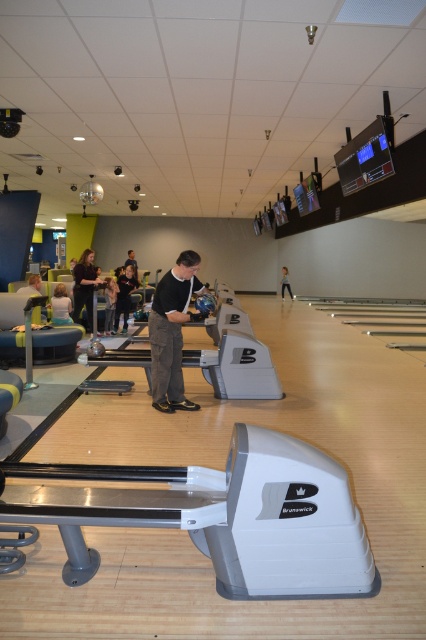
You are a photographer trying to capture a photo of the dark gray fabric pants at center and the dark gray pants at center. Which one appears taller in the image?

The dark gray fabric pants at center is taller than dark gray pants at center according to the description.

You are standing at the entrance of the bowling alley and see two points marked on the floor. The first point is at point (57, 308) and the second is at point (19, 289). If you want to walk towards the first point, which direction should you move relative to the second point?

Point (57, 308) is in front of point (19, 289), so you should move forward relative to the second point to reach the first point.

You are a photographer positioned at the entrance of the bowling alley. You want to capture a photo that includes both the dark brown leather jacket at left and the light brown hair at lower left. Based on their positions, which object should appear higher in the photo?

The light brown hair at lower left appears higher in the photo because the dark brown leather jacket at left is positioned below it.